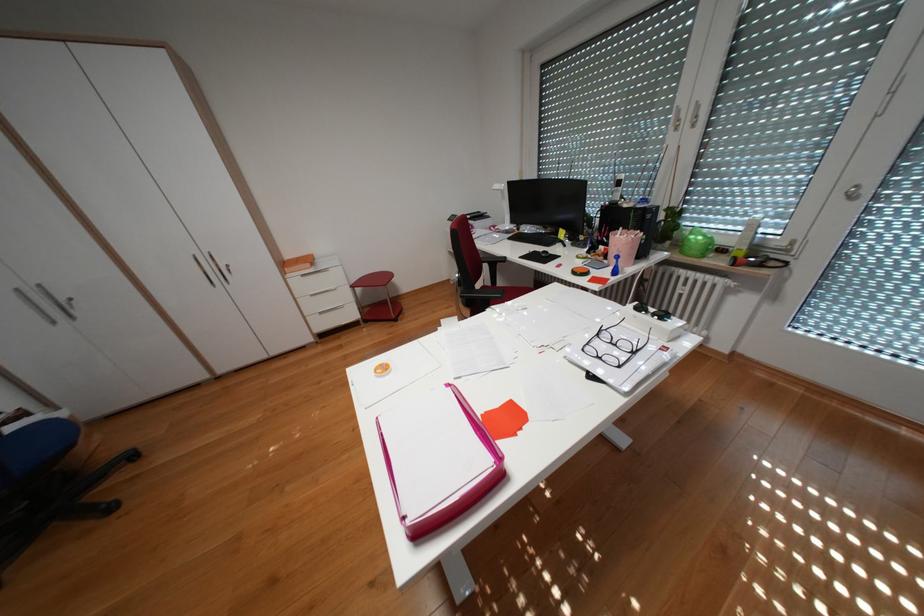
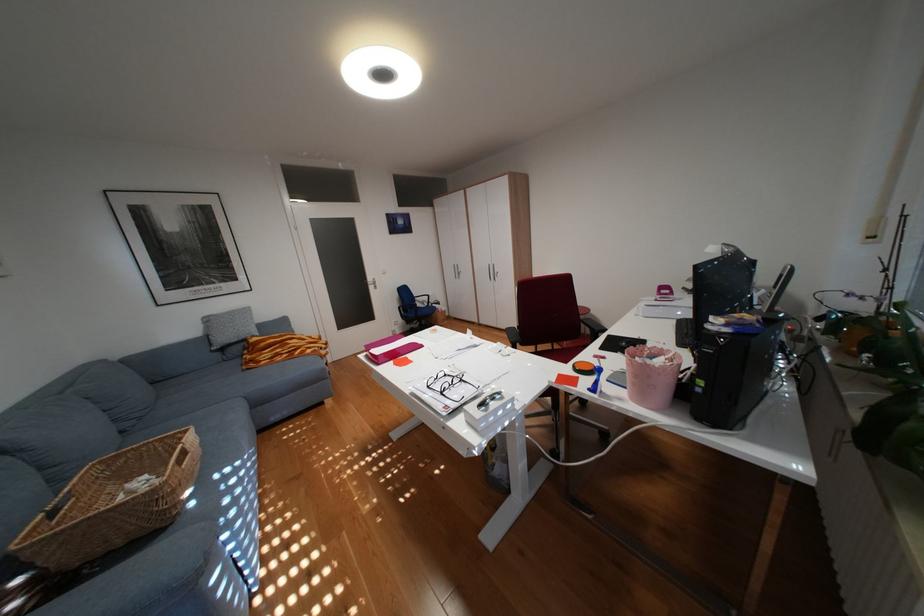
Where in the second image is the point corresponding to [647,352] from the first image?

(454, 392)